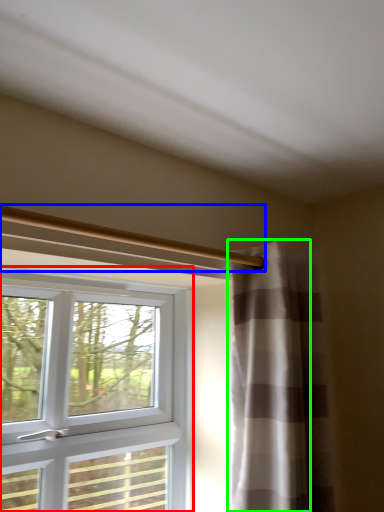
Question: Which is nearer to the window (highlighted by a red box)? beam (highlighted by a blue box) or curtain (highlighted by a green box).

Choices:
 (A) beam
 (B) curtain

Answer: (B)